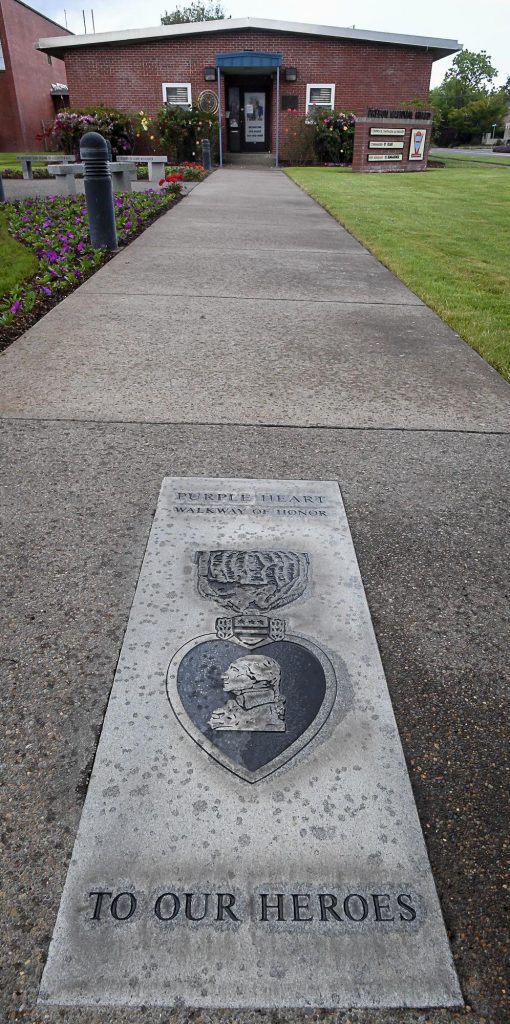
Where is `door`? The image size is (510, 1024). door is located at coordinates (250, 128).